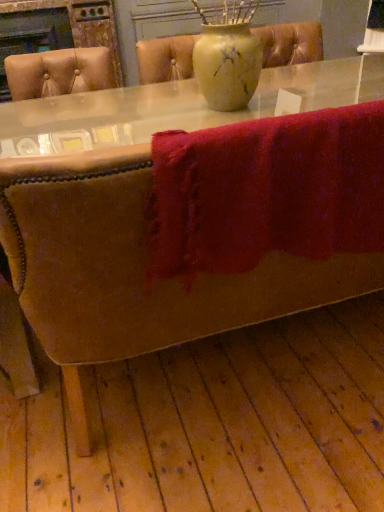
Question: Could you tell me if fuzzy red towel at lower center is facing matte yellow vase at center?

Choices:
 (A) yes
 (B) no

Answer: (A)

Question: Is fuzzy red towel at lower center thinner than matte yellow vase at center?

Choices:
 (A) no
 (B) yes

Answer: (B)

Question: Is fuzzy red towel at lower center oriented away from matte yellow vase at center?

Choices:
 (A) no
 (B) yes

Answer: (A)

Question: Does fuzzy red towel at lower center have a greater width compared to matte yellow vase at center?

Choices:
 (A) no
 (B) yes

Answer: (A)

Question: Does fuzzy red towel at lower center have a smaller size compared to matte yellow vase at center?

Choices:
 (A) no
 (B) yes

Answer: (B)

Question: Is fuzzy red towel at lower center not within matte yellow vase at center?

Choices:
 (A) yes
 (B) no

Answer: (A)

Question: Is matte yellow vase at center placed right next to fuzzy red towel at lower center?

Choices:
 (A) no
 (B) yes

Answer: (A)

Question: From a real-world perspective, does matte yellow vase at center sit lower than fuzzy red towel at lower center?

Choices:
 (A) yes
 (B) no

Answer: (B)

Question: Can you confirm if matte yellow vase at center is positioned to the left of fuzzy red towel at lower center?

Choices:
 (A) yes
 (B) no

Answer: (A)

Question: Can fuzzy red towel at lower center be found inside matte yellow vase at center?

Choices:
 (A) yes
 (B) no

Answer: (B)

Question: Can you confirm if matte yellow vase at center is bigger than fuzzy red towel at lower center?

Choices:
 (A) yes
 (B) no

Answer: (A)

Question: Is matte yellow vase at center looking in the opposite direction of fuzzy red towel at lower center?

Choices:
 (A) yes
 (B) no

Answer: (B)

Question: From a real-world perspective, relative to fuzzy red towel at lower center, is matte yellow vase at center vertically above or below?

Choices:
 (A) above
 (B) below

Answer: (A)